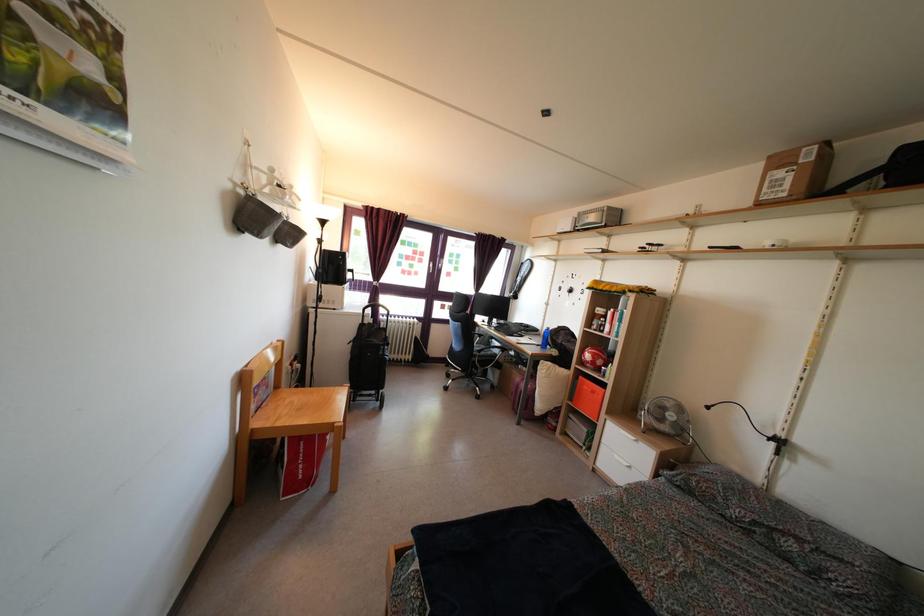
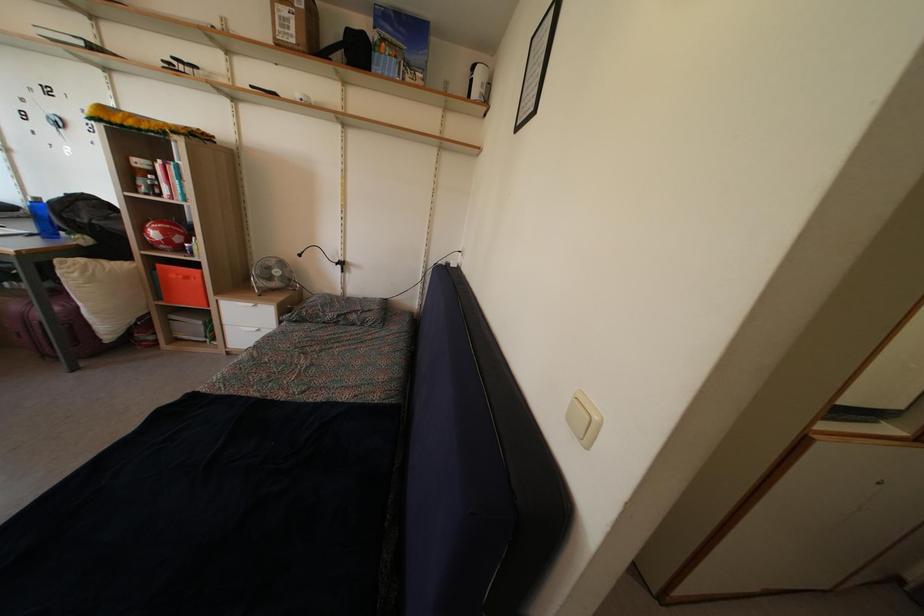
Find the pixel in the second image that matches point (674, 424) in the first image.

(280, 281)